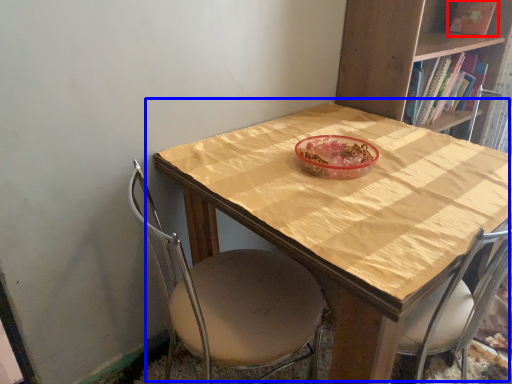
Question: Among these objects, which one is nearest to the camera, book (highlighted by a red box) or table (highlighted by a blue box)?

Choices:
 (A) book
 (B) table

Answer: (B)